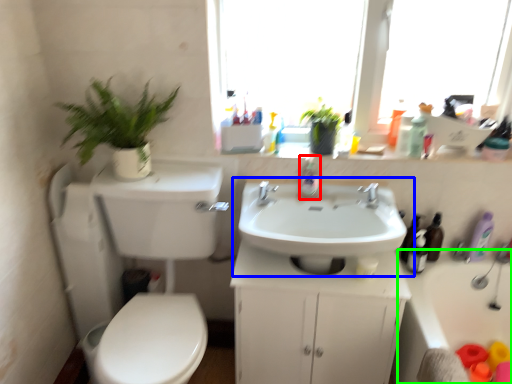
Question: Which is nearer to the soap dispenser (highlighted by a red box)? sink (highlighted by a blue box) or bath (highlighted by a green box).

Choices:
 (A) sink
 (B) bath

Answer: (A)